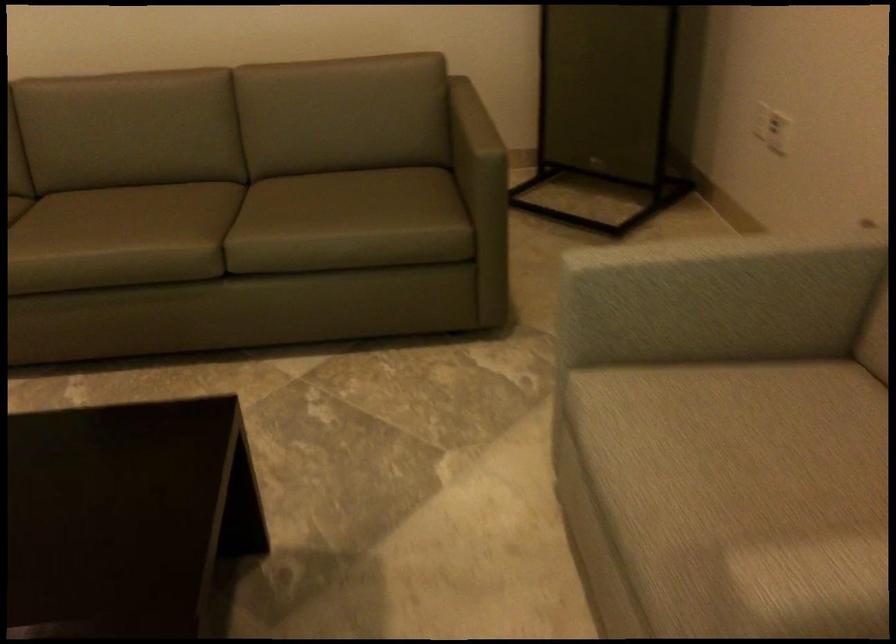
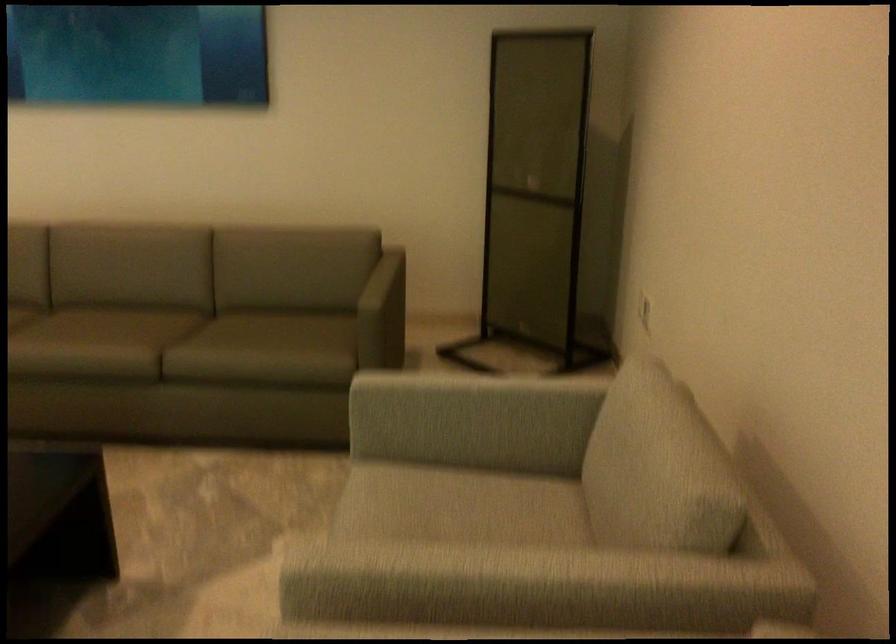
Where in the second image is the point corresponding to [174,210] from the first image?

(128, 327)